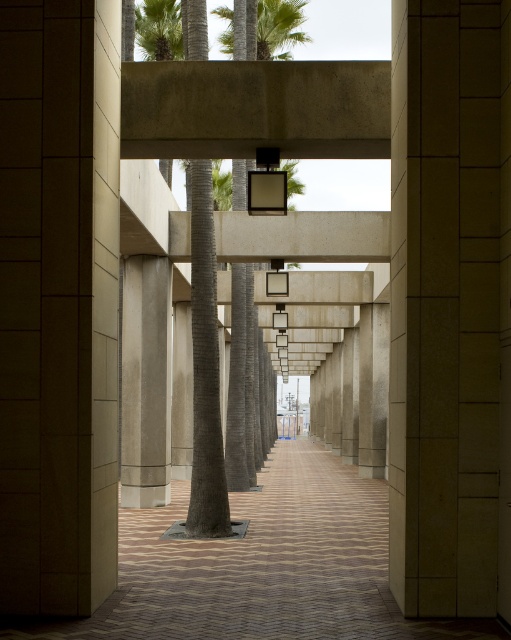
You are standing at the entrance of this architectural structure and want to walk towards the green textured palm tree at upper center. Is the brown brick path at lower center wide enough for you to comfortably walk on while approaching the palm tree?

The brown brick path at lower center is bigger than the green textured palm tree at upper center, so yes, the path is wide enough for comfortable walking towards the palm tree.

You are an architect designing a new garden layout. You have to place a statue that requires a base of 1.2 meters in diameter. Given the sanded concrete column at center and the green leafy palm tree at upper center, which object can accommodate the statue base without obstructing the view of the other object?

The green leafy palm tree at upper center can accommodate the statue base since the sanded concrete column at center is smaller in size and placing the statue there might block the view of the palm tree.